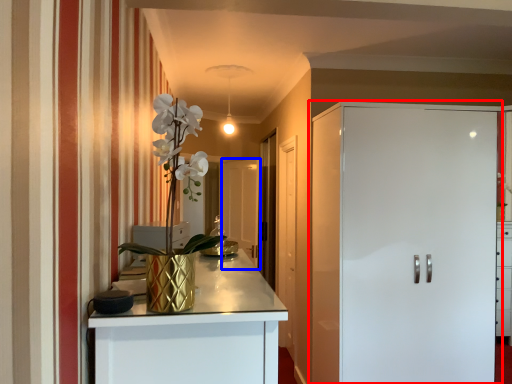
Question: Which point is further to the camera, door (highlighted by a red box) or glass door (highlighted by a blue box)?

Choices:
 (A) door
 (B) glass door

Answer: (B)